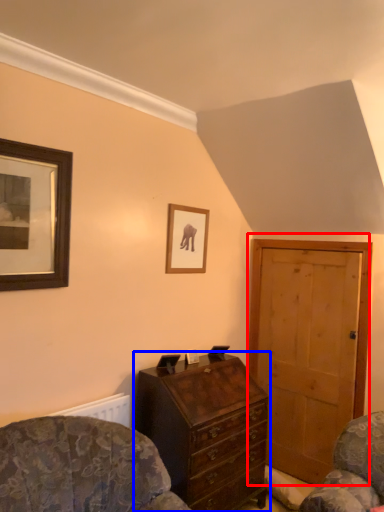
Question: Which point is further to the camera, door (highlighted by a red box) or chest of drawers (highlighted by a blue box)?

Choices:
 (A) door
 (B) chest of drawers

Answer: (A)